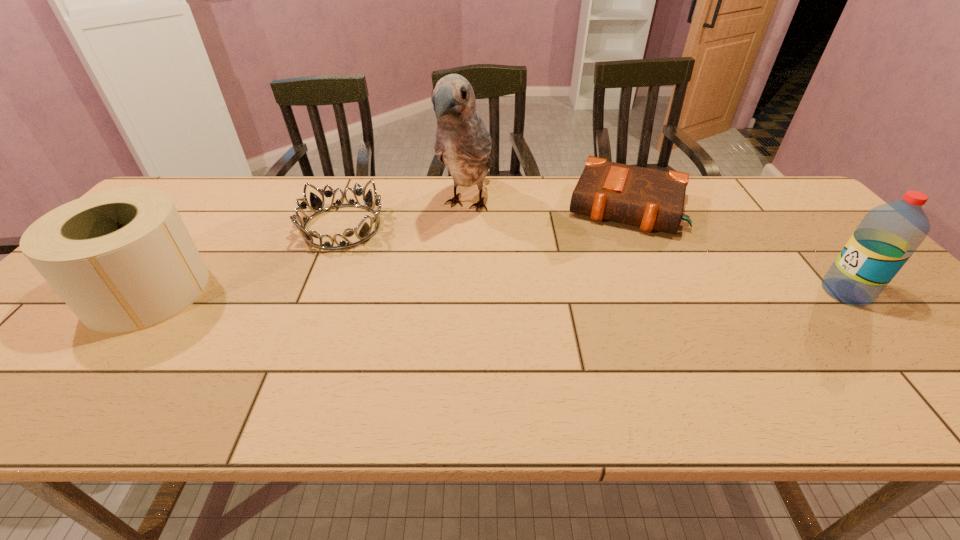
You are a GUI agent. You are given a task and a screenshot of the screen. Output one action in this format:
    pyautogui.click(x=<x>, y=<y>)
    Task: Click on the vacant space located 0.290m on the front label of the second tallest object
    The height and width of the screenshot is (540, 960).
    Given the screenshot: What is the action you would take?
    pyautogui.click(x=706, y=292)

I want to click on vacant space located 0.390m on the front label of the second tallest object, so click(x=664, y=292).

Identify the location of vacant area situated 0.170m on the front-facing side of the third object from right to left. The image size is (960, 540). (435, 277).

The width and height of the screenshot is (960, 540). In order to click on free space located on the front-facing side of the third object from right to left in this screenshot , I will do `click(441, 267)`.

Locate an element on the screen. The image size is (960, 540). vacant position located 0.090m on the front-facing side of the third object from right to left is located at coordinates (445, 258).

Locate an element on the screen. free space located 0.080m on the front-facing side of the tiara is located at coordinates (389, 254).

At what (x,y) coordinates should I click in order to perform the action: click on vacant space located 0.330m on the front-facing side of the tiara. Please return your answer as a coordinate pair (x, y). Looking at the image, I should click on (459, 295).

I want to click on free space located on the front-facing side of the tiara, so click(399, 260).

Where is `vacant region located on the spine side of the Bible`? The image size is (960, 540). vacant region located on the spine side of the Bible is located at coordinates (606, 268).

At what (x,y) coordinates should I click in order to perform the action: click on blank space located on the spine side of the Bible. Please return your answer as a coordinate pair (x, y). Image resolution: width=960 pixels, height=540 pixels. Looking at the image, I should click on (611, 253).